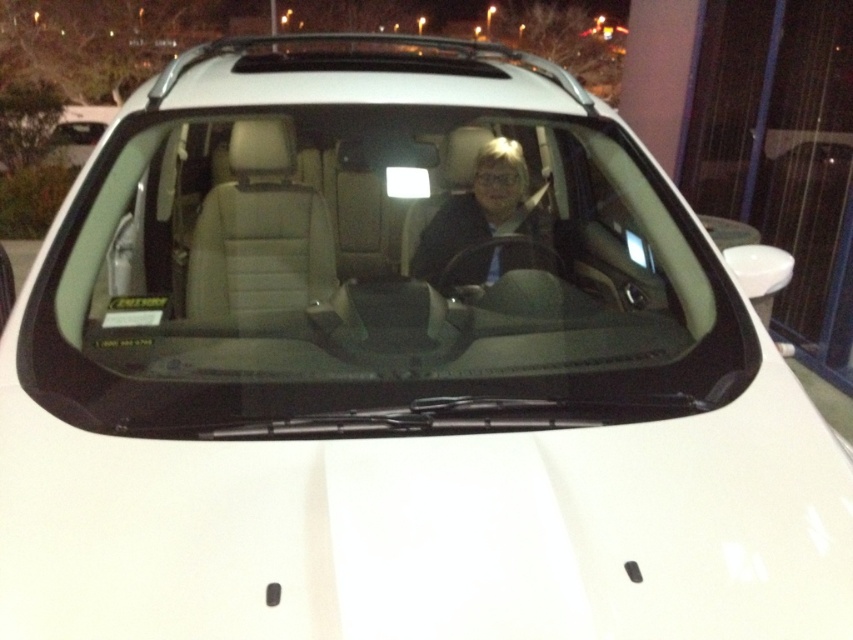
Question: Which point is closer to the camera taking this photo?

Choices:
 (A) (647, 312)
 (B) (491, 188)

Answer: (A)

Question: Can you confirm if transparent glass windshield at center is positioned above matte black jacket at center?

Choices:
 (A) yes
 (B) no

Answer: (B)

Question: Which object is farther from the camera taking this photo?

Choices:
 (A) matte black jacket at center
 (B) transparent glass windshield at center

Answer: (A)

Question: Can you confirm if transparent glass windshield at center is wider than matte black jacket at center?

Choices:
 (A) no
 (B) yes

Answer: (B)

Question: Is the position of transparent glass windshield at center less distant than that of matte black jacket at center?

Choices:
 (A) no
 (B) yes

Answer: (B)

Question: Which point is farther to the camera?

Choices:
 (A) transparent glass windshield at center
 (B) matte black jacket at center

Answer: (B)